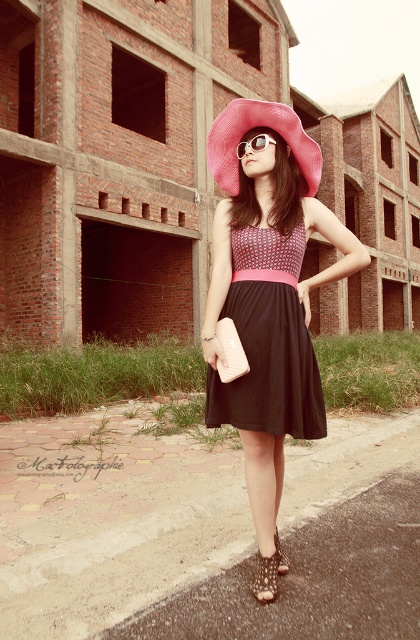
Question: Does leather textured sandal at lower center have a lesser width compared to sunglasses at center?

Choices:
 (A) yes
 (B) no

Answer: (A)

Question: Is leather textured sandal at lower center above black textured sandal at lower center?

Choices:
 (A) yes
 (B) no

Answer: (B)

Question: Which is nearer to the sunglasses at center?

Choices:
 (A) pink woven hat at center
 (B) pink straw hat at center
 (C) black textured sandal at lower center
 (D) leather textured sandal at lower center

Answer: (B)

Question: Does matte black dress at center appear on the right side of pink straw hat at center?

Choices:
 (A) no
 (B) yes

Answer: (A)

Question: Estimate the real-world distances between objects in this image. Which object is closer to the pink straw hat at center?

Choices:
 (A) leather textured sandal at lower center
 (B) matte black dress at center
 (C) sunglasses at center

Answer: (C)

Question: Which object appears farthest from the camera in this image?

Choices:
 (A) pink woven hat at center
 (B) matte black dress at center
 (C) pink straw hat at center

Answer: (C)